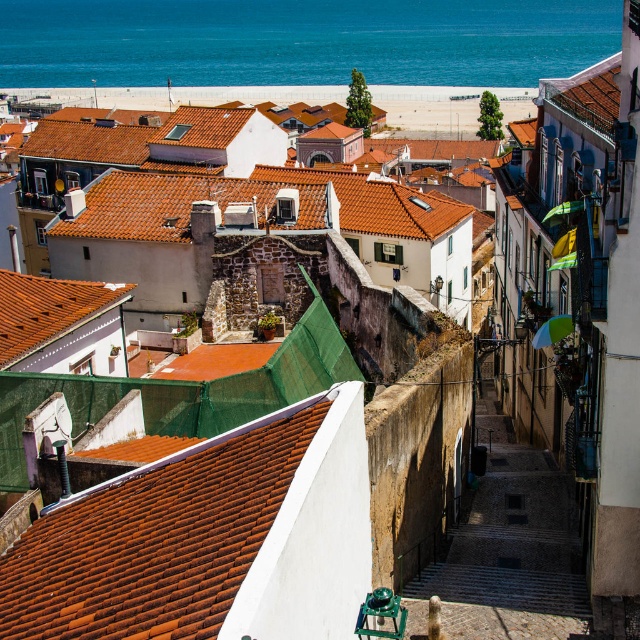
You are a tourist standing on the cobblestone street in the coastal town. You notice the orange tiled roof at center and the white sand beach at center. Which one appears lower in the scene?

The orange tiled roof at center appears lower than the white sand beach at center in the scene.

You are a tourist standing on the white sand beach at center and want to take a photo of the blue water at upper center. In which direction should you point your camera?

You should point your camera to the right to capture the blue water at upper center since it is located to the right of the white sand beach at center.

You are standing at the top of the cobblestone street in the coastal town. Looking towards the blue water at upper center, can you estimate its position in terms of coordinates?

The blue water at upper center is located at coordinates approximately 0.066 along the x axis and 0.472 along the y axis.